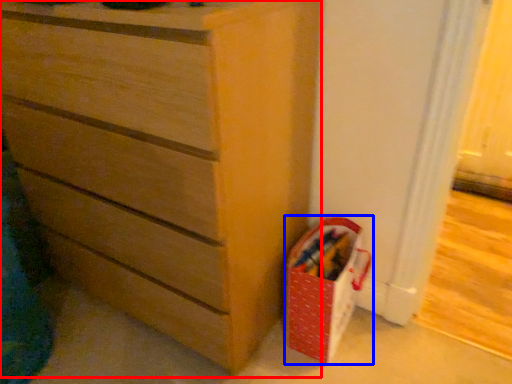
Question: Which of the following is the farthest to the observer, chest of drawers (highlighted by a red box) or kit (highlighted by a blue box)?

Choices:
 (A) chest of drawers
 (B) kit

Answer: (B)